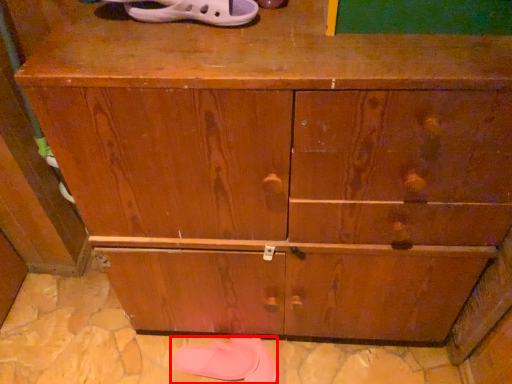
Question: From the image's perspective, what is the correct spatial relationship of footwear (annotated by the red box) in relation to footwear?

Choices:
 (A) above
 (B) below

Answer: (B)